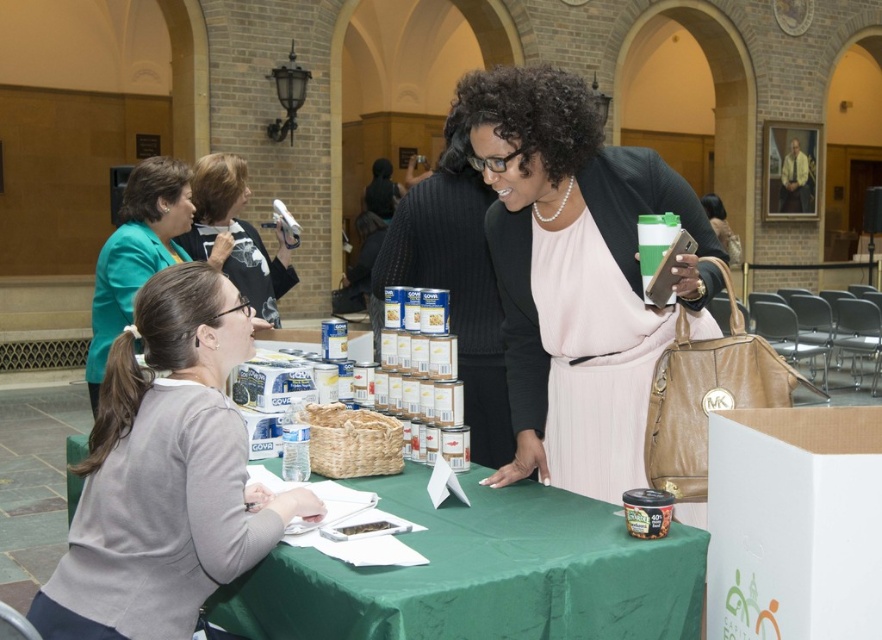
Question: In this image, where is matte black jacket at center located relative to gray sweater at lower left?

Choices:
 (A) right
 (B) left

Answer: (A)

Question: Is teal fabric jacket at upper left above matte black camera at upper center?

Choices:
 (A) no
 (B) yes

Answer: (A)

Question: Which of the following is the closest to the observer?

Choices:
 (A) (170, 634)
 (B) (375, 596)

Answer: (B)

Question: Estimate the real-world distances between objects in this image. Which object is farther from the teal fabric jacket at upper left?

Choices:
 (A) gray sweater at lower left
 (B) matte black jacket at center
 (C) matte black camera at upper center
 (D) metallic silver knife at center

Answer: (D)

Question: Can you confirm if teal fabric jacket at upper left is bigger than matte black camera at upper center?

Choices:
 (A) no
 (B) yes

Answer: (A)

Question: Which point is closer to the camera taking this photo?

Choices:
 (A) (349, 534)
 (B) (277, 259)
 (C) (260, 557)

Answer: (C)